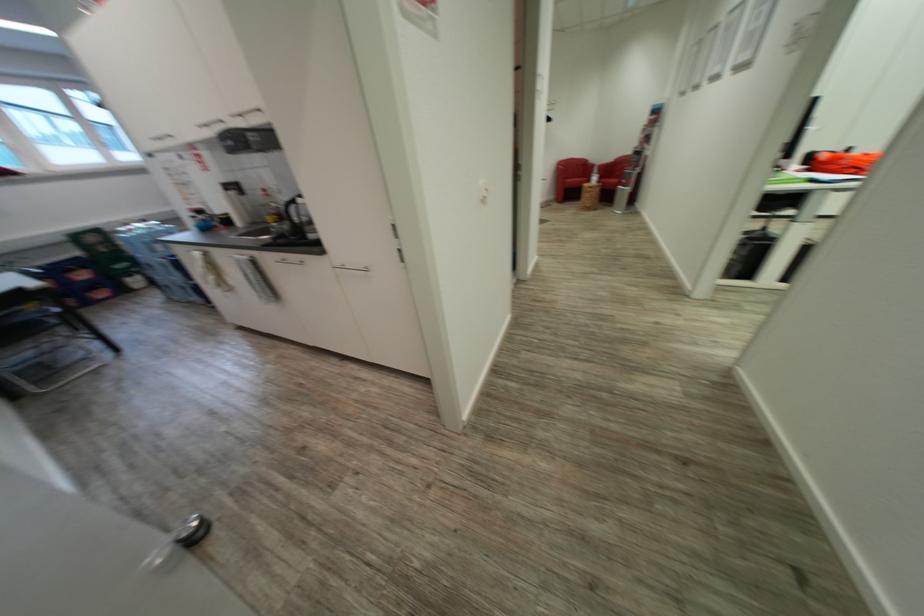
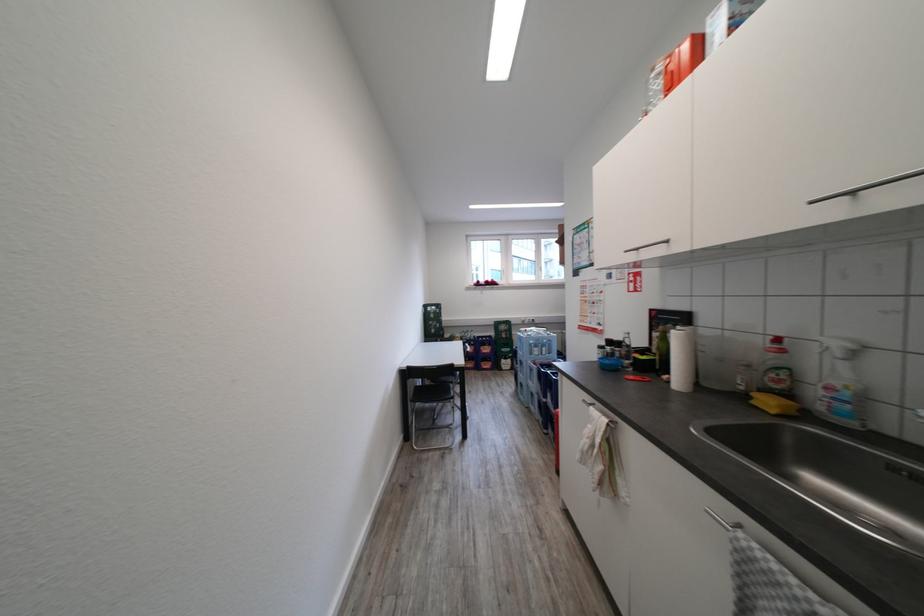
Where in the second image is the point corresponding to (x=269, y=217) from the first image?

(768, 402)